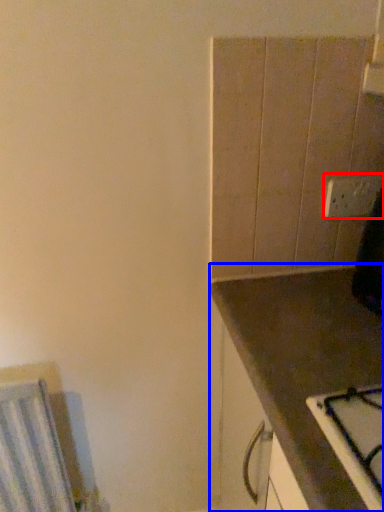
Question: Which object appears farthest to the camera in this image, electric outlet (highlighted by a red box) or countertop (highlighted by a blue box)?

Choices:
 (A) electric outlet
 (B) countertop

Answer: (A)